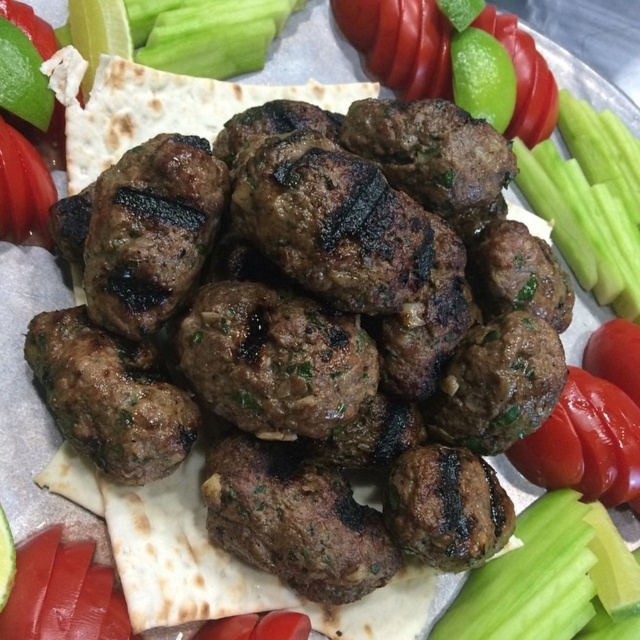
Describe the element at coordinates (531, 579) in the screenshot. I see `green crisp celery at center` at that location.

Identify the location of green crisp celery at center. (531, 579).

Find the location of a particular element. green crisp celery at center is located at coordinates (531, 579).

Is brown grilled meatballs at center closer to camera compared to green crisp celery at center?

Yes, brown grilled meatballs at center is in front of green crisp celery at center.

Where is `brown grilled meatballs at center`? Image resolution: width=640 pixels, height=640 pixels. brown grilled meatballs at center is located at coordinates (310, 289).

Describe the element at coordinates (310, 289) in the screenshot. The width and height of the screenshot is (640, 640). I see `brown grilled meatballs at center` at that location.

Is brown grilled meatballs at center thinner than red matte tomato at lower right?

In fact, brown grilled meatballs at center might be wider than red matte tomato at lower right.

Is point (422, 168) positioned after point (532, 444)?

No, it is not.

Where is `brown grilled meatballs at center`? Image resolution: width=640 pixels, height=640 pixels. brown grilled meatballs at center is located at coordinates (310, 289).